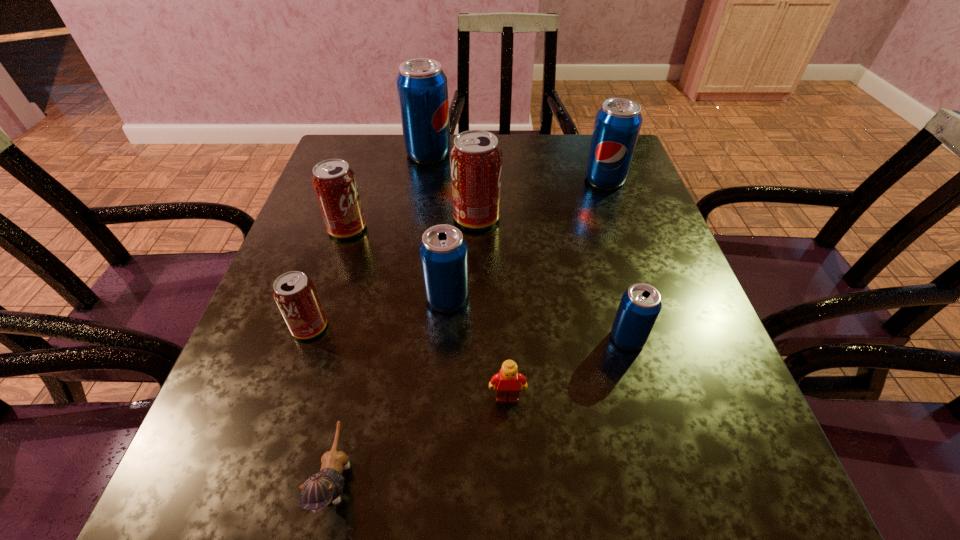
Image resolution: width=960 pixels, height=540 pixels. In order to click on the tallest object in this screenshot , I will do click(x=422, y=88).

In order to click on the farthest object in this screenshot , I will do `click(422, 88)`.

Where is `the third smallest blue pop soda`? The width and height of the screenshot is (960, 540). the third smallest blue pop soda is located at coordinates (617, 125).

Where is `the second farthest object`? The height and width of the screenshot is (540, 960). the second farthest object is located at coordinates (617, 125).

Find the location of a particular element. The width and height of the screenshot is (960, 540). the rightmost red soda can is located at coordinates (475, 158).

Find the location of a particular element. This screenshot has height=540, width=960. the third farthest blue pop soda is located at coordinates (443, 250).

At what (x,y) coordinates should I click in order to perform the action: click on the second biggest red soda can. Please return your answer as a coordinate pair (x, y). Looking at the image, I should click on (334, 182).

Find the location of a particular element. Image resolution: width=960 pixels, height=540 pixels. the smallest blue pop soda is located at coordinates (640, 305).

The height and width of the screenshot is (540, 960). I want to click on the nearest red soda can, so click(x=294, y=293).

I want to click on brown Lego, so click(x=506, y=382).